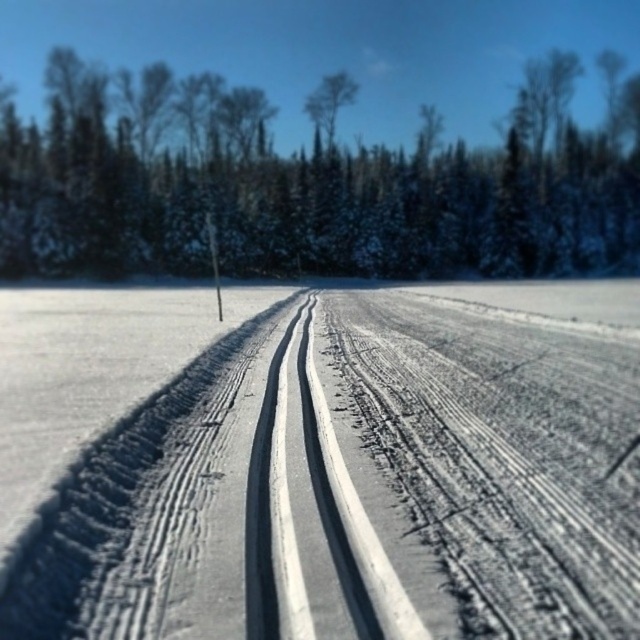
Based on the scene description, what is located at the coordinates point (300, 198)?

The point (300, 198) indicates green textured trees at center.

You are standing at the edge of the snow covered path in the image. You see a point marked at [317,465] which is on the gray textured dirt track at center. If you walk straight ahead along the path, will you eventually reach the dense forest in the middle ground?

Yes, walking straight ahead along the snow covered path will lead you to the dense forest in the middle ground because the path in the image leads towards the forest.

You are standing at the edge of the snowy landscape and see the gray textured dirt track at center and the green textured trees at center. Which object is positioned to the left?

The gray textured dirt track at center is to the left of green textured trees at center.